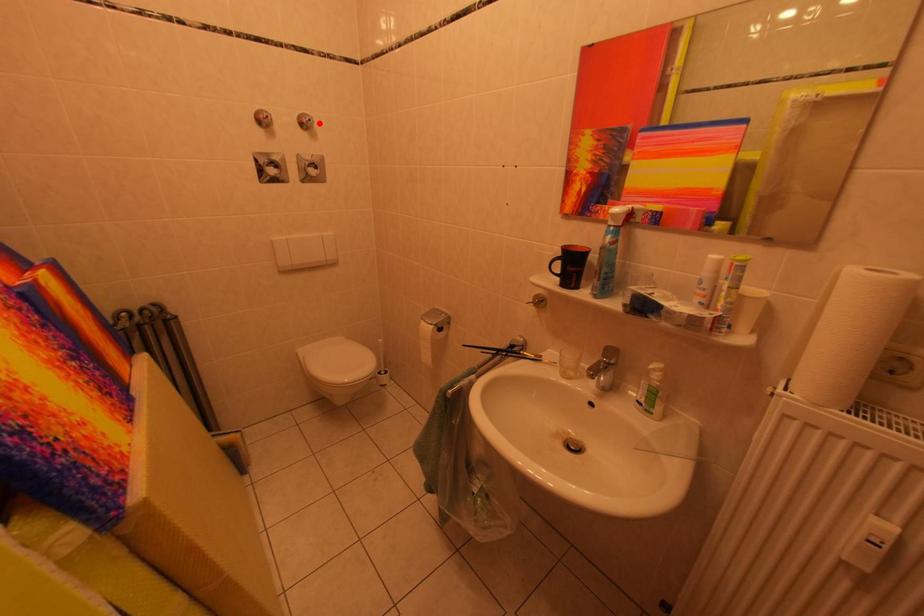
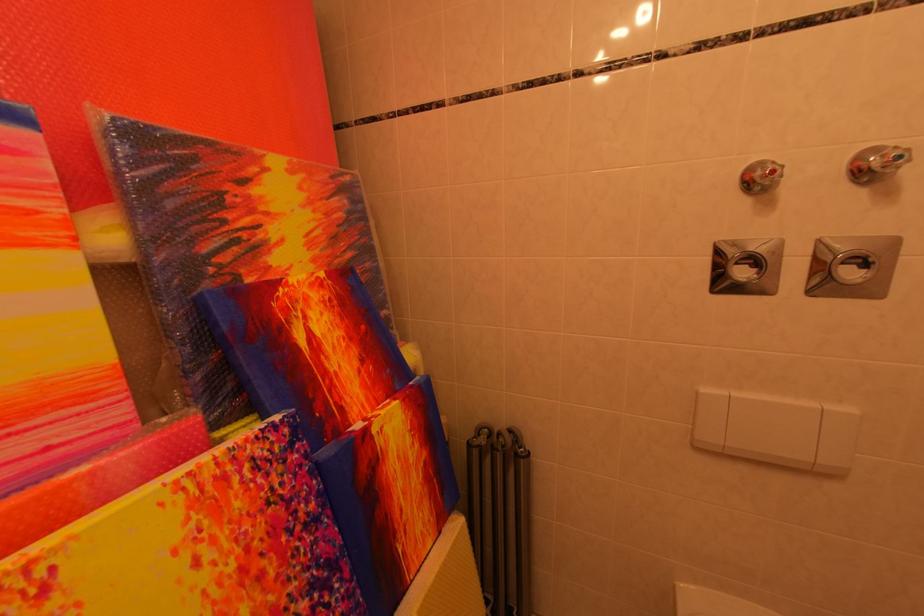
Question: I am providing you with two images of the same scene from different viewpoints. A red point is shown in image1. For the corresponding object point in image2, is it positioned nearer or farther from the camera?

Choices:
 (A) Nearer
 (B) Farther

Answer: (B)